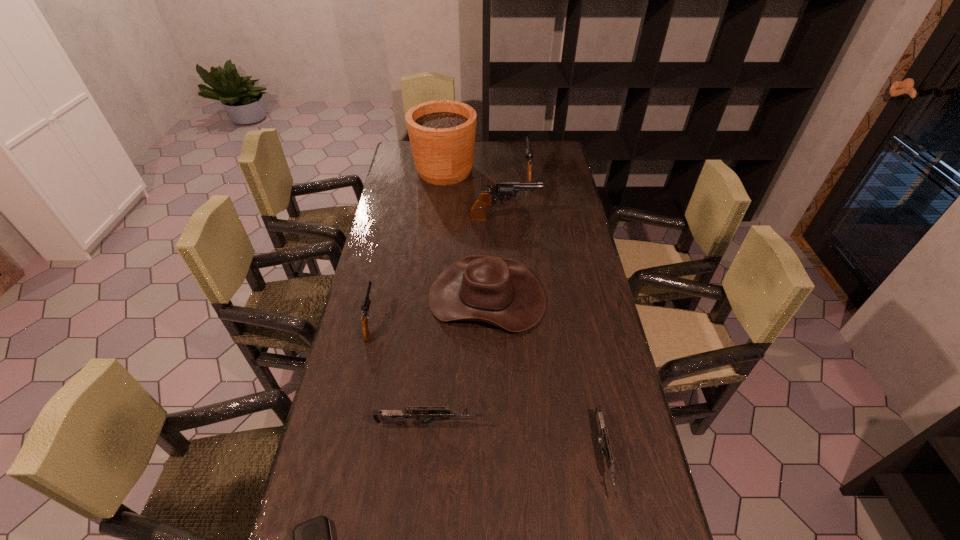
Where is `free region at the far right corner of the desktop`? The width and height of the screenshot is (960, 540). free region at the far right corner of the desktop is located at coordinates (531, 145).

I want to click on vacant space that is in between the fourth shortest object and the bigger grey gun, so click(x=399, y=373).

At what (x,y) coordinates should I click in order to perform the action: click on free space between the rightmost object and the bigger grey gun. Please return your answer as a coordinate pair (x, y). Looking at the image, I should click on click(516, 440).

Locate an element on the screen. The height and width of the screenshot is (540, 960). free spot between the right grey gun and the third tallest gun is located at coordinates (488, 389).

I want to click on vacant space that is in between the third nearest gun and the cowboy hat, so click(x=429, y=310).

The height and width of the screenshot is (540, 960). I want to click on vacant space that's between the farthest black gun and the tallest object, so click(486, 173).

Identify which object is located as the fourth nearest to the seventh shortest object. Please provide its 2D coordinates. Your answer should be formatted as a tuple, i.e. [(x, y)], where the tuple contains the x and y coordinates of a point satisfying the conditions above.

[(366, 301)]

Identify which object is the fourth nearest to the flowerpot. Please provide its 2D coordinates. Your answer should be formatted as a tuple, i.e. [(x, y)], where the tuple contains the x and y coordinates of a point satisfying the conditions above.

[(366, 301)]

At what (x,y) coordinates should I click in order to perform the action: click on the closest gun to the remote control. Please return your answer as a coordinate pair (x, y). This screenshot has height=540, width=960. Looking at the image, I should click on (420, 413).

Locate which gun ranks second in proximity to the flowerpot. Please provide its 2D coordinates. Your answer should be formatted as a tuple, i.e. [(x, y)], where the tuple contains the x and y coordinates of a point satisfying the conditions above.

[(528, 152)]